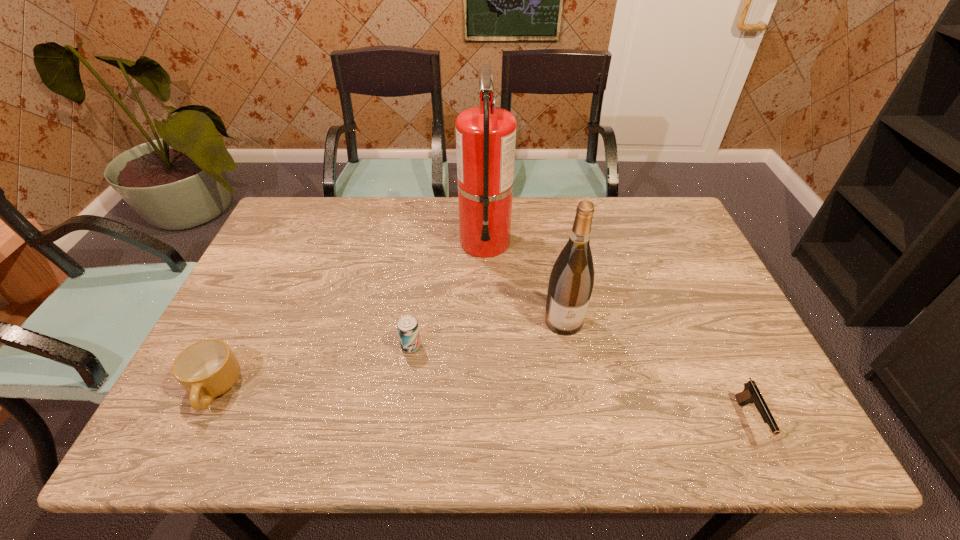
The height and width of the screenshot is (540, 960). Find the location of `vacant position located 0.250m on the label of the fourth shortest object`. vacant position located 0.250m on the label of the fourth shortest object is located at coordinates (584, 431).

Where is `free space located on the right of the beer can`? Image resolution: width=960 pixels, height=540 pixels. free space located on the right of the beer can is located at coordinates tap(564, 346).

I want to click on object positioned at the far edge, so coord(485,135).

This screenshot has width=960, height=540. I want to click on mug present at the near edge, so click(206, 369).

Locate an element on the screen. This screenshot has width=960, height=540. pistol positioned at the near edge is located at coordinates (751, 394).

The height and width of the screenshot is (540, 960). Identify the location of object present at the left edge. (206, 369).

Where is `object positioned at the right edge`? This screenshot has height=540, width=960. object positioned at the right edge is located at coordinates (751, 394).

Locate an element on the screen. object that is at the near left corner is located at coordinates (206, 369).

Where is `object at the near right corner`? This screenshot has width=960, height=540. object at the near right corner is located at coordinates (751, 394).

The image size is (960, 540). I want to click on vacant space at the far edge, so click(453, 226).